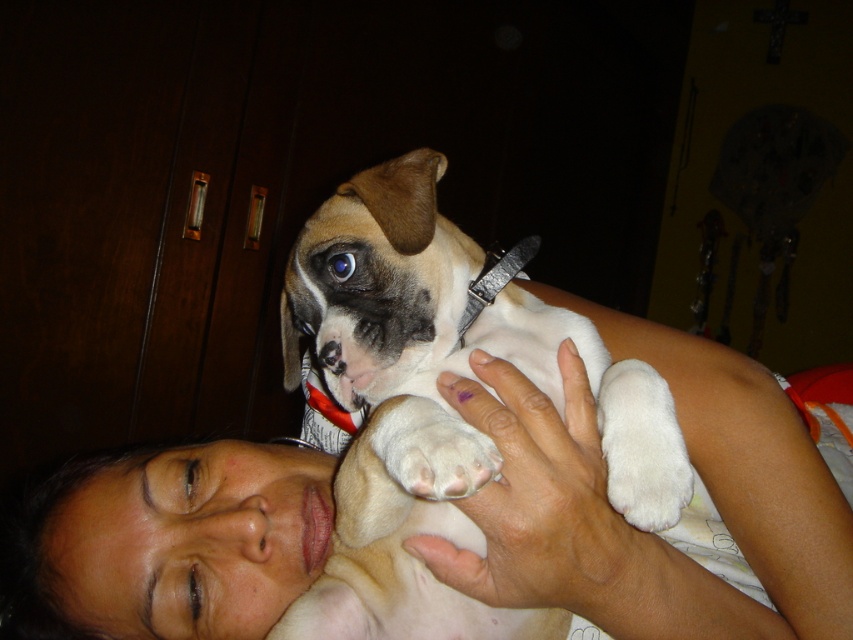
Question: Is smooth skin face at center below white matte dog at center?

Choices:
 (A) yes
 (B) no

Answer: (A)

Question: Is smooth skin face at center above white matte dog at center?

Choices:
 (A) no
 (B) yes

Answer: (A)

Question: Can you confirm if smooth skin face at center is bigger than white matte dog at center?

Choices:
 (A) no
 (B) yes

Answer: (B)

Question: Considering the real-world distances, which object is farthest from the white matte dog at center?

Choices:
 (A) smooth skin face at center
 (B) white soft paw at center

Answer: (B)

Question: Which is nearer to the white matte dog at center?

Choices:
 (A) white soft paw at center
 (B) smooth skin face at center

Answer: (B)

Question: Which object is positioned closest to the smooth skin face at center?

Choices:
 (A) white matte dog at center
 (B) white soft paw at center

Answer: (A)